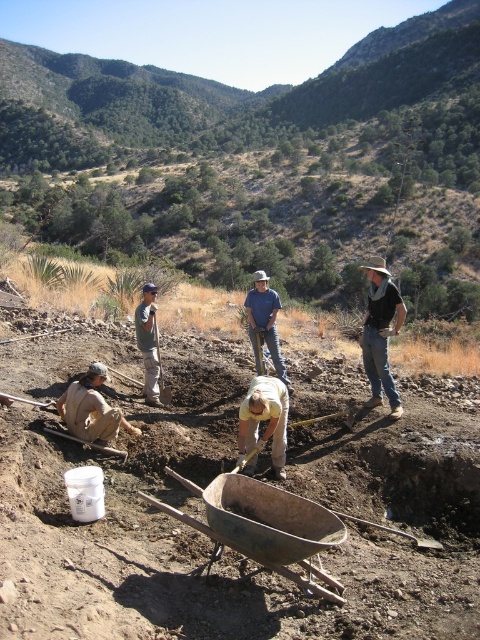
You are standing in the rugged outdoor setting looking at the five individuals. Which of the two points, point (274,417) or point (145,352), is closer to you?

Point (274,417) is closer to the camera than point (145,352).

You are a worker in the group and need to choose between the blue denim shirt at center and the brushed metal shovel at lower left for a task that requires handling a heavy load. Based on their sizes, which object might be more suitable for the task?

The brushed metal shovel at lower left is wider than the blue denim shirt at center, so it might be more suitable for handling heavy loads due to its larger size.